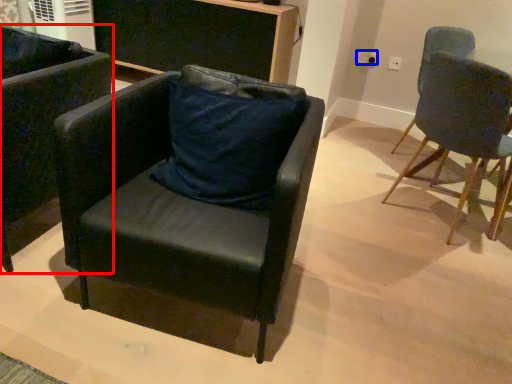
Question: Which point is closer to the camera, chair (highlighted by a red box) or power outlet (highlighted by a blue box)?

Choices:
 (A) chair
 (B) power outlet

Answer: (A)